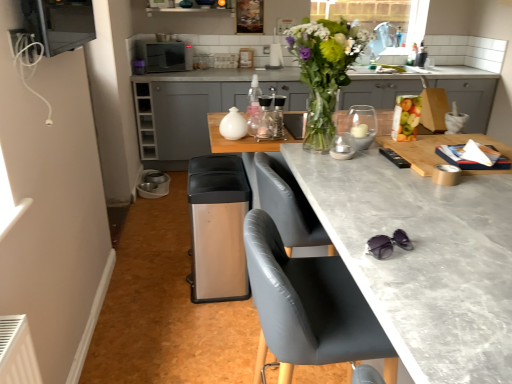
Question: Could you tell me if metallic silver microwave at upper left, placed as the fourth appliance when sorted from right to left, is facing satin black microwave at upper center?

Choices:
 (A) no
 (B) yes

Answer: (A)

Question: Does metallic silver microwave at upper left, placed as the fourth appliance when sorted from right to left, have a greater width compared to satin black microwave at upper center?

Choices:
 (A) no
 (B) yes

Answer: (A)

Question: Is there a large distance between metallic silver microwave at upper left, acting as the 4th appliance starting from the back, and satin black microwave at upper center?

Choices:
 (A) yes
 (B) no

Answer: (A)

Question: From the image's perspective, would you say metallic silver microwave at upper left, acting as the 4th appliance starting from the back, is shown under satin black microwave at upper center?

Choices:
 (A) yes
 (B) no

Answer: (A)

Question: Is metallic silver microwave at upper left, the fourth appliance from the bottom, bigger than satin black microwave at upper center?

Choices:
 (A) no
 (B) yes

Answer: (A)

Question: Is metallic silver microwave at upper left, placed as the fourth appliance when sorted from right to left, smaller than satin black microwave at upper center?

Choices:
 (A) yes
 (B) no

Answer: (A)

Question: From the image's perspective, is white glossy jar at center, placed as the 2th appliance when sorted from back to front, over matte gray cabinets at center?

Choices:
 (A) yes
 (B) no

Answer: (B)

Question: From a real-world perspective, does white glossy jar at center, which appears as the second appliance when viewed from the right, stand above matte gray cabinets at center?

Choices:
 (A) yes
 (B) no

Answer: (A)

Question: Is white glossy jar at center, which is the 3th appliance in bottom-to-top order, not close to matte gray cabinets at center?

Choices:
 (A) yes
 (B) no

Answer: (A)

Question: Is white glossy jar at center, placed as the 2th appliance when sorted from back to front, to the left of matte gray cabinets at center from the viewer's perspective?

Choices:
 (A) no
 (B) yes

Answer: (B)

Question: Is the depth of white glossy jar at center, which ranks as the second appliance in top-to-bottom order, greater than that of matte gray cabinets at center?

Choices:
 (A) no
 (B) yes

Answer: (A)

Question: Does white glossy jar at center, which appears as the second appliance when viewed from the right, have a larger size compared to matte gray cabinets at center?

Choices:
 (A) no
 (B) yes

Answer: (A)

Question: Are translucent glass candle holder at center, the 3th appliance from the top, and stainless steel trash can at lower center, the 1th appliance when ordered from bottom to top, far apart?

Choices:
 (A) no
 (B) yes

Answer: (A)